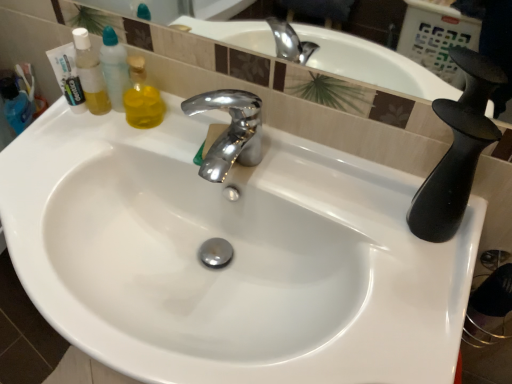
Question: From the image's perspective, does polished chrome faucet at center appear lower than white glossy sink at center?

Choices:
 (A) yes
 (B) no

Answer: (B)

Question: Considering the relative sizes of polished chrome faucet at center and white glossy sink at center in the image provided, is polished chrome faucet at center shorter than white glossy sink at center?

Choices:
 (A) yes
 (B) no

Answer: (A)

Question: From a real-world perspective, is polished chrome faucet at center over white glossy sink at center?

Choices:
 (A) no
 (B) yes

Answer: (B)

Question: Considering the relative positions of polished chrome faucet at center and white glossy sink at center in the image provided, is polished chrome faucet at center behind white glossy sink at center?

Choices:
 (A) no
 (B) yes

Answer: (B)

Question: Are polished chrome faucet at center and white glossy sink at center located far from each other?

Choices:
 (A) no
 (B) yes

Answer: (A)

Question: In the image, is translucent plastic mouthwash at left positioned in front of or behind polished chrome faucet at center?

Choices:
 (A) front
 (B) behind

Answer: (A)

Question: From a real-world perspective, is translucent plastic mouthwash at left positioned above or below polished chrome faucet at center?

Choices:
 (A) below
 (B) above

Answer: (B)

Question: From the image's perspective, is translucent plastic mouthwash at left positioned above or below polished chrome faucet at center?

Choices:
 (A) below
 (B) above

Answer: (B)

Question: Considering the positions of translucent plastic mouthwash at left and polished chrome faucet at center in the image, is translucent plastic mouthwash at left bigger or smaller than polished chrome faucet at center?

Choices:
 (A) big
 (B) small

Answer: (A)

Question: Is point (79, 76) closer or farther from the camera than point (302, 218)?

Choices:
 (A) farther
 (B) closer

Answer: (A)

Question: From a real-world perspective, is translucent plastic mouthwash at left physically located above or below white glossy sink at center?

Choices:
 (A) above
 (B) below

Answer: (A)

Question: In the image, is translucent plastic mouthwash at left positioned in front of or behind white glossy sink at center?

Choices:
 (A) behind
 (B) front

Answer: (A)

Question: Is translucent plastic mouthwash at left to the left or to the right of white glossy sink at center in the image?

Choices:
 (A) right
 (B) left

Answer: (B)

Question: Is polished chrome faucet at center situated inside translucent plastic mouthwash at left or outside?

Choices:
 (A) inside
 (B) outside

Answer: (B)

Question: In terms of size, does polished chrome faucet at center appear bigger or smaller than translucent plastic mouthwash at left?

Choices:
 (A) big
 (B) small

Answer: (B)